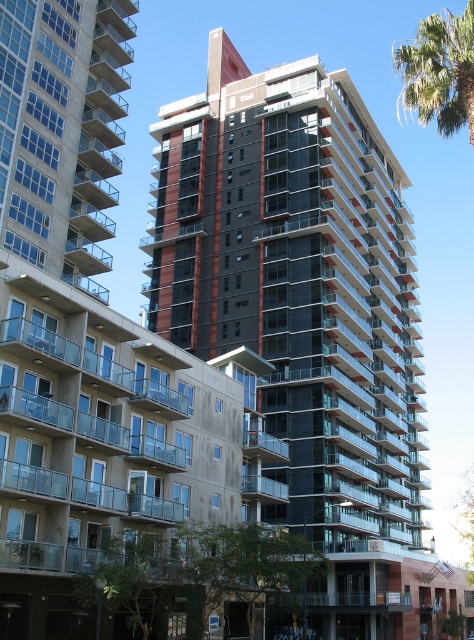
Looking at this image, you are standing in front of the modern residential building complex. You see a point labeled as point (299, 282). Where exactly is this point located on the building?

The point (299, 282) is on the dark glass building at center.

You are standing in front of the modern residential building complex and want to take a photo that includes both the dark glass building at center and the green leafy palm tree at upper right. Based on their positions, where should you position the palm tree in the frame relative to the building?

The dark glass building at center is below the green leafy palm tree at upper right, so to include both in the photo, position the palm tree at the upper part of the frame and the building at the lower part.

Looking at this image, you are a drone operator who needs to deliver a package to the dark glass building at center. According to the coordinates provided, where should you aim your drone to ensure accurate delivery?

The dark glass building at center is located at coordinates point (299, 282), so you should aim your drone at that specific point for accurate delivery.